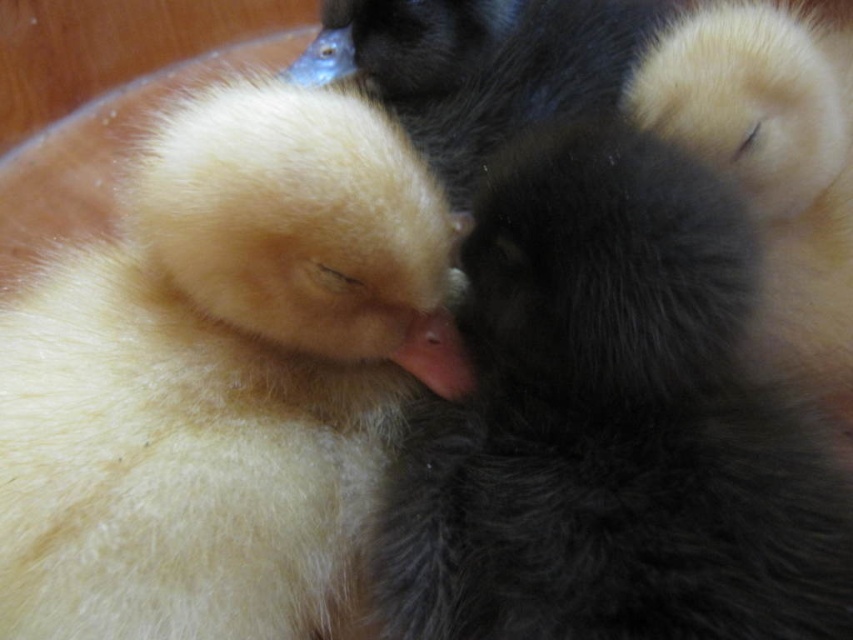
Is soft yellow duckling at left shorter than fluffy yellow duckling at upper right?

Indeed, soft yellow duckling at left has a lesser height compared to fluffy yellow duckling at upper right.

Find the location of a particular element. Image resolution: width=853 pixels, height=640 pixels. soft yellow duckling at left is located at coordinates pos(219,374).

At what (x,y) coordinates should I click in order to perform the action: click on soft yellow duckling at left. Please return your answer as a coordinate pair (x, y). The image size is (853, 640). Looking at the image, I should click on (219, 374).

Between black fluffy cat at center and fluffy yellow duckling at upper right, which one appears on the right side from the viewer's perspective?

fluffy yellow duckling at upper right

Which is in front, point (473, 540) or point (727, 22)?

Positioned in front is point (473, 540).

Find the location of a particular element. This screenshot has width=853, height=640. black fluffy cat at center is located at coordinates (613, 424).

This screenshot has width=853, height=640. Identify the location of soft yellow duckling at left. (219, 374).

Between point (257, 458) and point (613, 61), which one is positioned in front?

Positioned in front is point (257, 458).

This screenshot has height=640, width=853. Identify the location of soft yellow duckling at left. (219, 374).